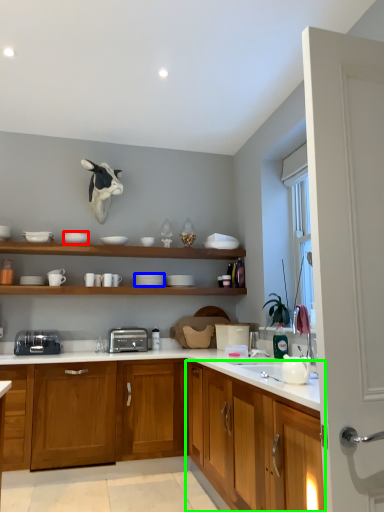
Question: Estimate the real-world distances between objects in this image. Which object is farther from tableware (highlighted by a red box), tableware (highlighted by a blue box) or cabinetry (highlighted by a green box)?

Choices:
 (A) tableware
 (B) cabinetry

Answer: (B)